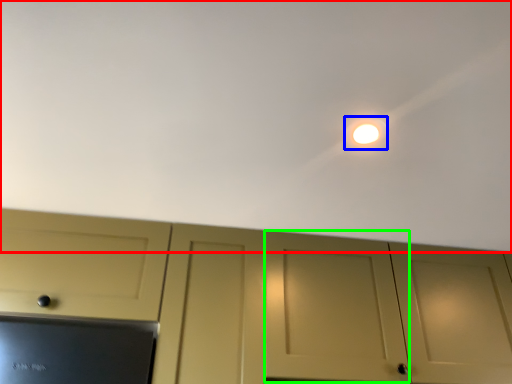
Question: Which is nearer to the backdrop (highlighted by a red box)? light (highlighted by a blue box) or door (highlighted by a green box).

Choices:
 (A) light
 (B) door

Answer: (A)